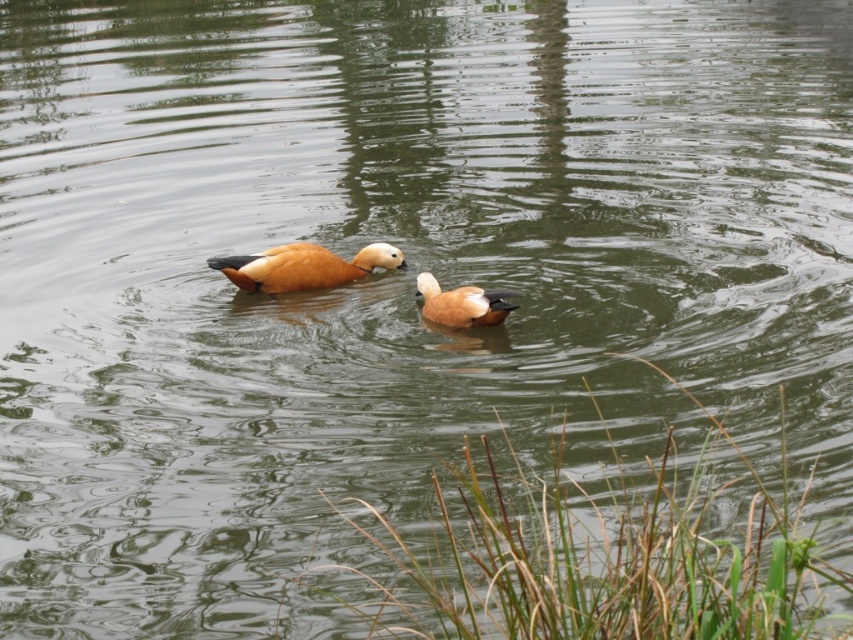
Question: Is brown glossy duck at center to the right of brown fluffy duck at center from the viewer's perspective?

Choices:
 (A) no
 (B) yes

Answer: (A)

Question: Among these points, which one is nearest to the camera?

Choices:
 (A) (379, 253)
 (B) (427, 285)

Answer: (B)

Question: Which of the following is the closest to the observer?

Choices:
 (A) (480, 291)
 (B) (404, 262)

Answer: (A)

Question: Does brown glossy duck at center have a larger size compared to brown fluffy duck at center?

Choices:
 (A) yes
 (B) no

Answer: (A)

Question: Which point is closer to the camera taking this photo?

Choices:
 (A) (x=258, y=269)
 (B) (x=463, y=300)

Answer: (B)

Question: Where is brown glossy duck at center located in relation to brown fluffy duck at center in the image?

Choices:
 (A) above
 (B) below

Answer: (A)